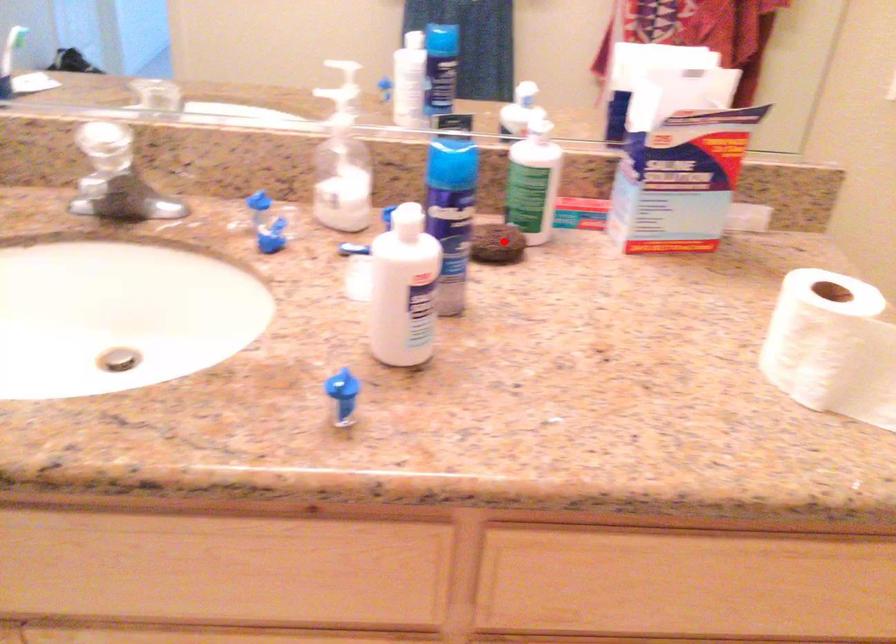
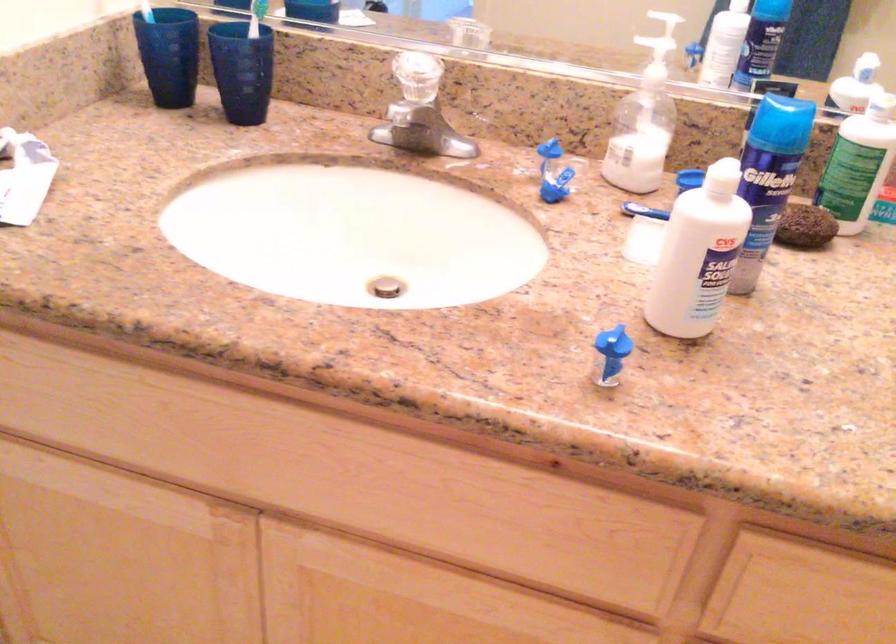
The point at the highlighted location is marked in the first image. Where is the corresponding point in the second image?

(805, 227)